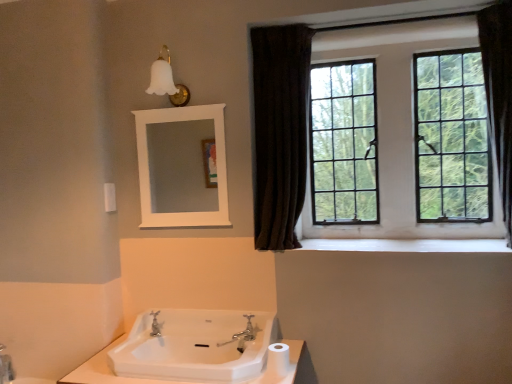
Locate an element on the screen. This screenshot has height=384, width=512. free space underneath dark brown velvet curtain at upper right (from a real-world perspective) is located at coordinates (301, 246).